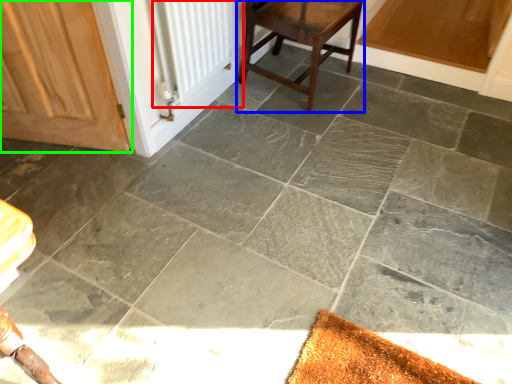
Question: Considering the real-world distances, which object is farthest from radiator (highlighted by a red box)? stool (highlighted by a blue box) or door (highlighted by a green box)?

Choices:
 (A) stool
 (B) door

Answer: (B)